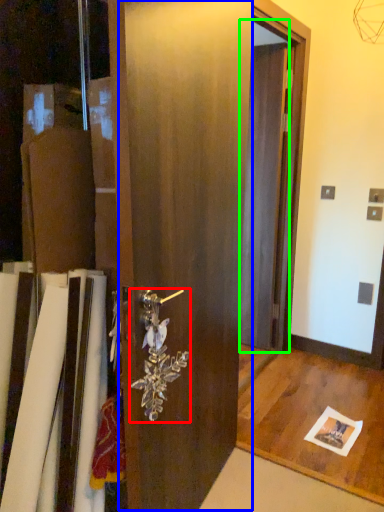
Question: Based on their relative distances, which object is nearer to door handle (highlighted by a red box)? Choose from barn door (highlighted by a blue box) and screen door (highlighted by a green box).

Choices:
 (A) barn door
 (B) screen door

Answer: (A)